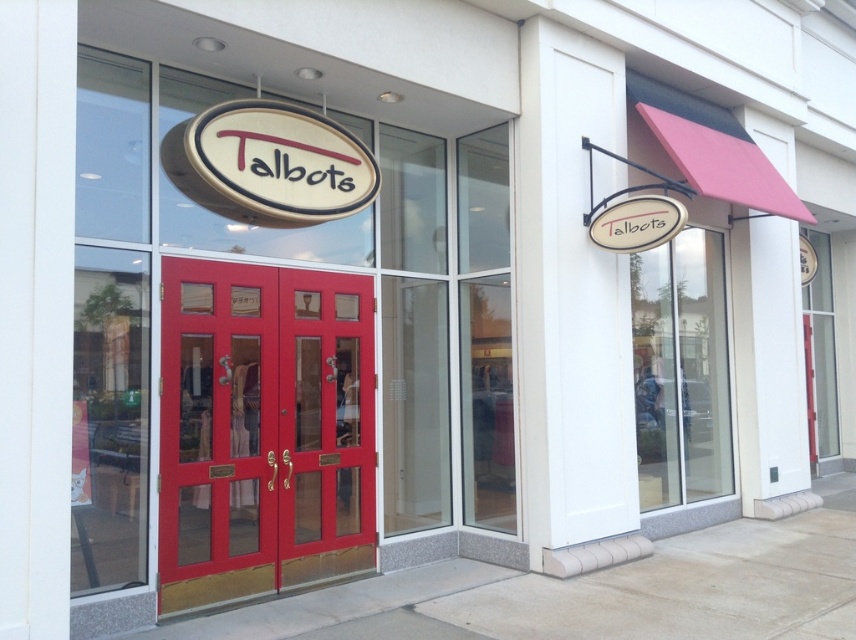
Can you confirm if matte wood door at center is positioned above white wood sign at upper right?

Actually, matte wood door at center is below white wood sign at upper right.

Is matte wood door at center in front of white wood sign at upper right?

Yes, it is in front of white wood sign at upper right.

Between point (366, 486) and point (660, 236), which one is positioned behind?

Point (366, 486)

You are a GUI agent. You are given a task and a screenshot of the screen. Output one action in this format:
    pyautogui.click(x=<x>, y=<y>)
    Task: Click on the matte wood door at center
    
    Given the screenshot: What is the action you would take?
    pyautogui.click(x=262, y=429)

Does matte glass door at center appear on the left side of transparent glass door at center?

Indeed, matte glass door at center is positioned on the left side of transparent glass door at center.

Which is behind, point (354, 436) or point (708, 304)?

The point (708, 304) is behind.

I want to click on matte glass door at center, so click(x=325, y=426).

Between matte glass door at center and matte white oval sign at center, which one has less height?

With less height is matte white oval sign at center.

You are a GUI agent. You are given a task and a screenshot of the screen. Output one action in this format:
    pyautogui.click(x=<x>, y=<y>)
    Task: Click on the matte glass door at center
    
    Given the screenshot: What is the action you would take?
    [325, 426]